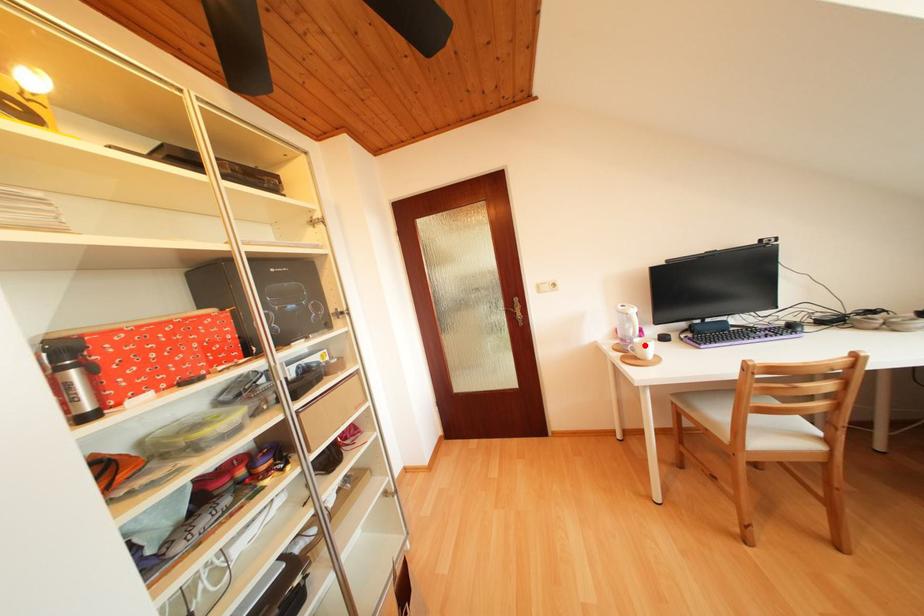
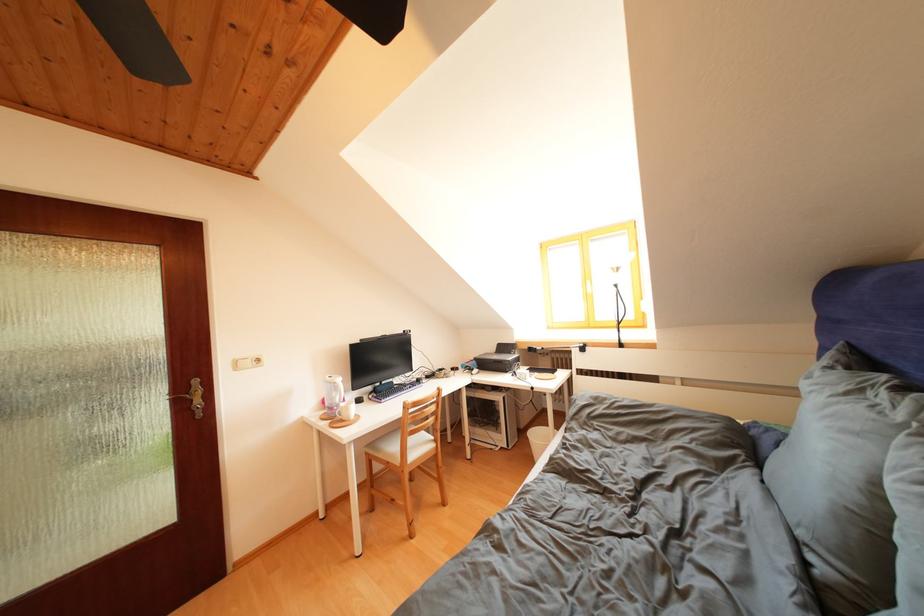
Find the pixel in the second image that matches the highlighted location in the first image.

(350, 410)